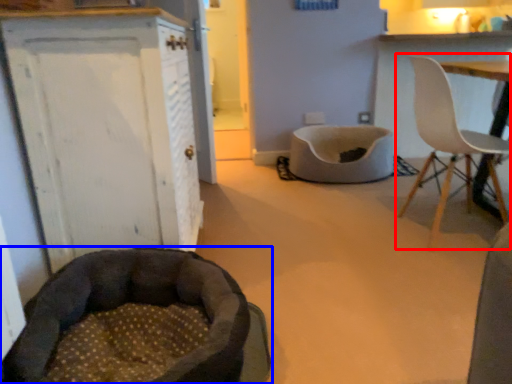
Question: Which of the following is the farthest to the observer, chair (highlighted by a red box) or dog bed (highlighted by a blue box)?

Choices:
 (A) chair
 (B) dog bed

Answer: (A)